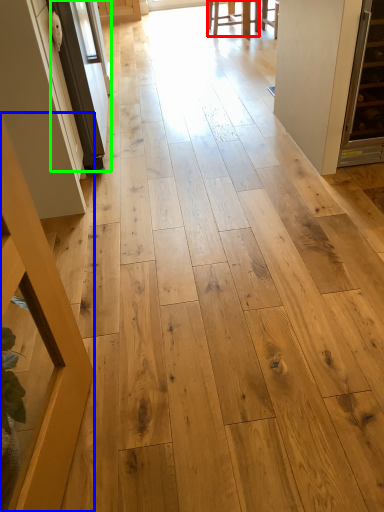
Question: Which object is positioned farthest from furniture (highlighted by a red box)? Select from furniture (highlighted by a blue box) and screen door (highlighted by a green box).

Choices:
 (A) furniture
 (B) screen door

Answer: (A)